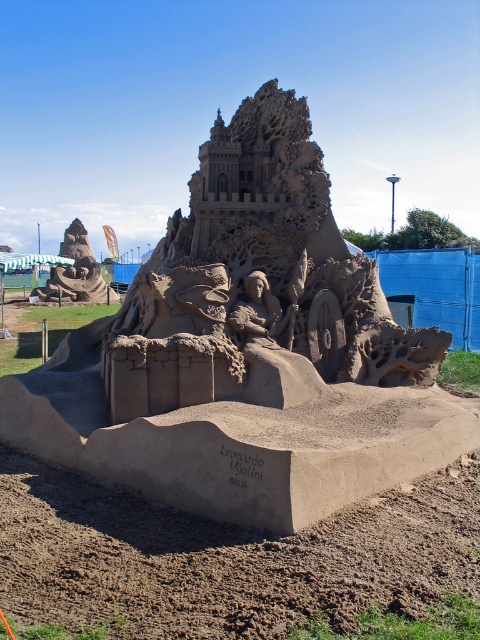
Based on the photo, you are a photographer planning to take a wide shot of both the natural sand sandcastle at center and the sandcastle at left. Given that your camera can capture a maximum distance of 20 meters between the closest and farthest objects in focus, will both sandcastles be in focus in a single shot?

The natural sand sandcastle at center and sandcastle at left are 21.95 meters apart from each other. Since the camera can only focus up to 20 meters, the distance between them exceeds the camera s maximum focus range. Therefore, both sandcastles cannot be in focus simultaneously in a single shot.

You are a sand sculpture artist who wants to place a new decorative element between the natural sand sandcastle at center and the sandcastle at left. Given their widths, which sandcastle should you place the element closer to?

The natural sand sandcastle at center is wider than the sandcastle at left. Therefore, you should place the decorative element closer to the sandcastle at left to ensure balance between the two structures.